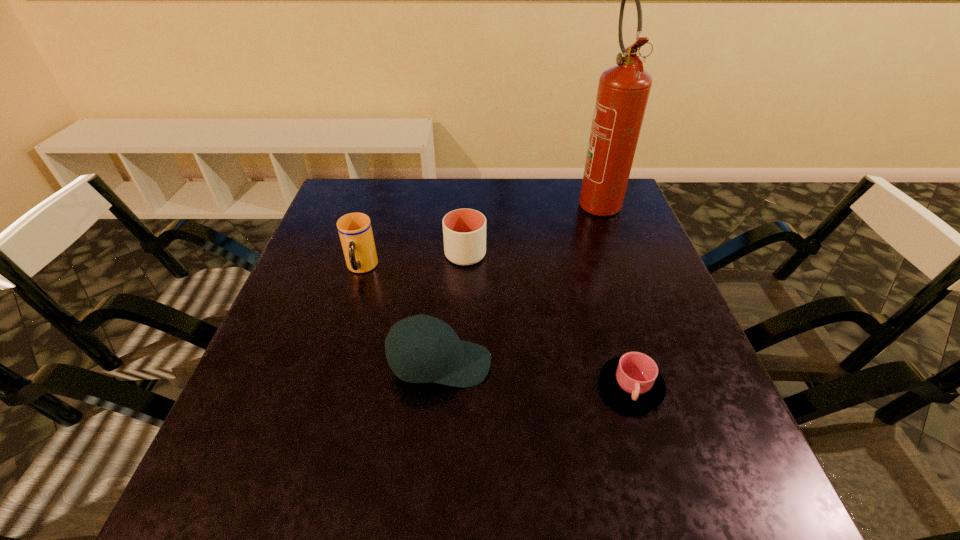
Find the location of a particular element. Image resolution: width=960 pixels, height=540 pixels. the tallest object is located at coordinates (623, 91).

In order to click on fire extinguisher in this screenshot , I will do `click(623, 91)`.

The image size is (960, 540). What are the coordinates of `the leftmost object` in the screenshot? It's located at (355, 231).

Image resolution: width=960 pixels, height=540 pixels. I want to click on the tallest cup, so click(355, 231).

I want to click on baseball cap, so pyautogui.click(x=441, y=357).

Image resolution: width=960 pixels, height=540 pixels. I want to click on the second cup from right to left, so click(x=464, y=230).

Find the location of `the nearest cup`. the nearest cup is located at coordinates (632, 380).

You are a GUI agent. You are given a task and a screenshot of the screen. Output one action in this format:
    pyautogui.click(x=<x>, y=<y>)
    Task: Click on the shortest object
    The height and width of the screenshot is (540, 960).
    Given the screenshot: What is the action you would take?
    pyautogui.click(x=632, y=380)

This screenshot has width=960, height=540. Identify the location of vacant space situated 0.070m from the nozzle of the fire extinguisher. pos(612,238).

The image size is (960, 540). In order to click on blank space located 0.310m on the side of the tallest cup with the handle in this screenshot , I will do `click(323, 396)`.